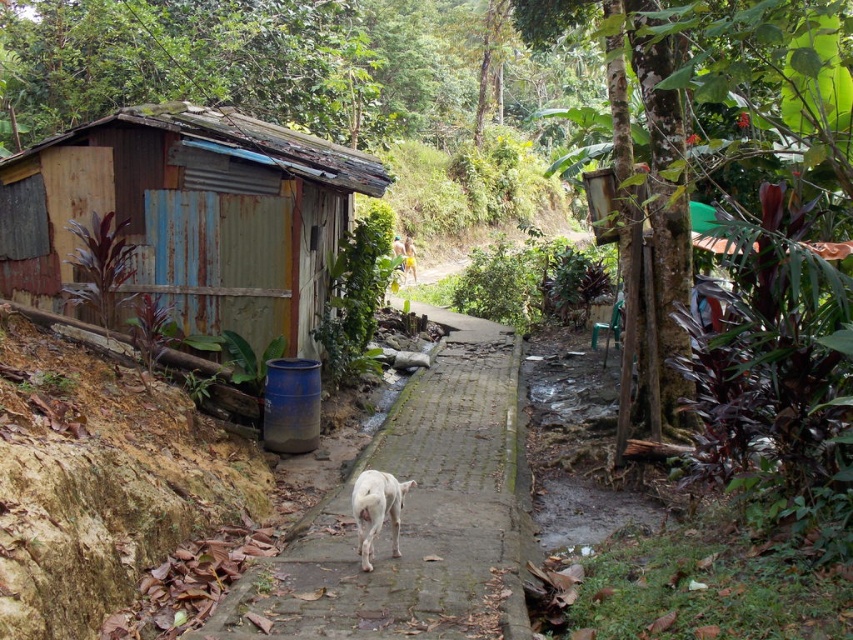
Question: Which object is the closest to the gray concrete pavement at center?

Choices:
 (A) rusty wood hut at left
 (B) white fur dog at center

Answer: (B)

Question: Does rusty wood hut at left have a lesser width compared to white fur dog at center?

Choices:
 (A) no
 (B) yes

Answer: (A)

Question: Does rusty wood hut at left have a smaller size compared to gray concrete pavement at center?

Choices:
 (A) yes
 (B) no

Answer: (B)

Question: Which point is farther to the camera?

Choices:
 (A) (360, 515)
 (B) (230, 300)
 (C) (468, 628)

Answer: (B)

Question: Is the position of gray concrete pavement at center less distant than that of white fur dog at center?

Choices:
 (A) yes
 (B) no

Answer: (A)

Question: Which is farther from the rusty wood hut at left?

Choices:
 (A) gray concrete pavement at center
 (B) white fur dog at center

Answer: (B)